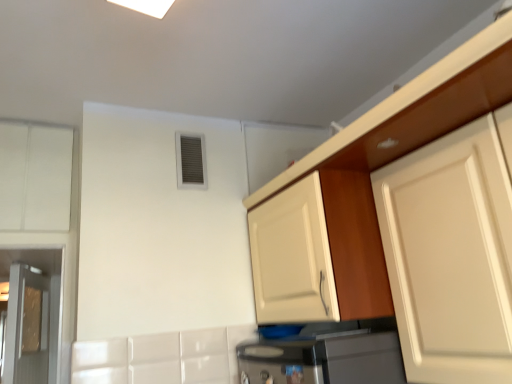
Question: Does point pyautogui.click(x=370, y=276) appear closer or farther from the camera than point pyautogui.click(x=364, y=226)?

Choices:
 (A) closer
 (B) farther

Answer: (A)

Question: Is white glossy cabinet at upper right, placed as the third cabinetry when sorted from left to right, in front of or behind matte white cabinet at center, which ranks as the third cabinetry in right-to-left order, in the image?

Choices:
 (A) front
 (B) behind

Answer: (A)

Question: Which is farther from the white glossy cabinet at upper right, placed as the third cabinetry when sorted from left to right?

Choices:
 (A) metallic glass door at left
 (B) white matte cabinet at upper right, the first cabinetry viewed from the right
 (C) matte white cabinet at center, which appears as the second cabinetry when viewed from the left
 (D) white matte cabinet at left, which appears as the 4th cabinetry when viewed from the right

Answer: (A)

Question: Estimate the real-world distances between objects in this image. Which object is closer to the white matte cabinet at left, which appears as the 4th cabinetry when viewed from the right?

Choices:
 (A) white glossy cabinet at upper right, placed as the third cabinetry when sorted from left to right
 (B) metallic glass door at left
 (C) matte white cabinet at center, which ranks as the third cabinetry in right-to-left order
 (D) white matte cabinet at upper right, the first cabinetry viewed from the right

Answer: (B)